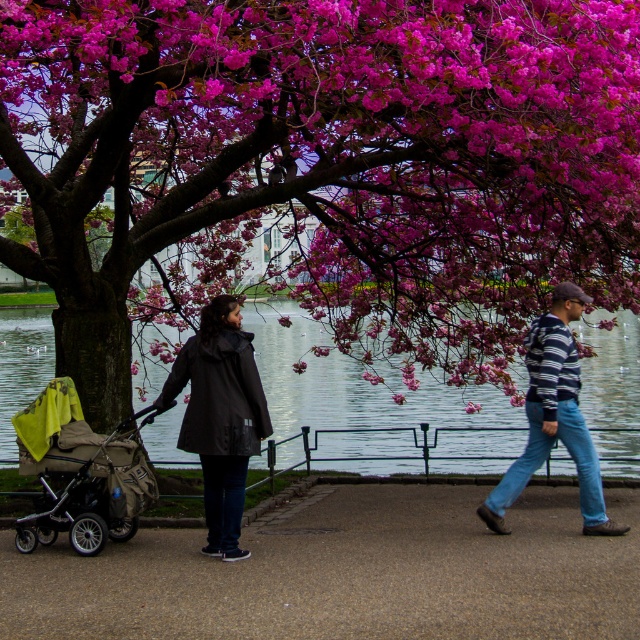
Is transparent water at center to the right of matte black coat at center from the viewer's perspective?

In fact, transparent water at center is to the left of matte black coat at center.

In the scene shown: Who is taller, transparent water at center or matte black coat at center?

Standing taller between the two is transparent water at center.

Which is in front, point (296, 412) or point (225, 397)?

Positioned in front is point (225, 397).

The width and height of the screenshot is (640, 640). I want to click on transparent water at center, so click(374, 397).

Is point (376, 358) farther from camera compared to point (480, 596)?

Yes, point (376, 358) is behind point (480, 596).

Which of these two, pink blossom tree at center or concrete sidewalk at center, stands shorter?

concrete sidewalk at center

The height and width of the screenshot is (640, 640). What do you see at coordinates (321, 168) in the screenshot?
I see `pink blossom tree at center` at bounding box center [321, 168].

Find the location of `pink blossom tree at center`. pink blossom tree at center is located at coordinates (321, 168).

Can you confirm if green fabric stroller at lower left is taller than striped sweater at center?

Incorrect, green fabric stroller at lower left's height is not larger of striped sweater at center's.

Does point (48, 387) come closer to viewer compared to point (477, 506)?

Yes, point (48, 387) is closer to viewer.

Find the location of `green fabric stroller at lower left`. green fabric stroller at lower left is located at coordinates (81, 474).